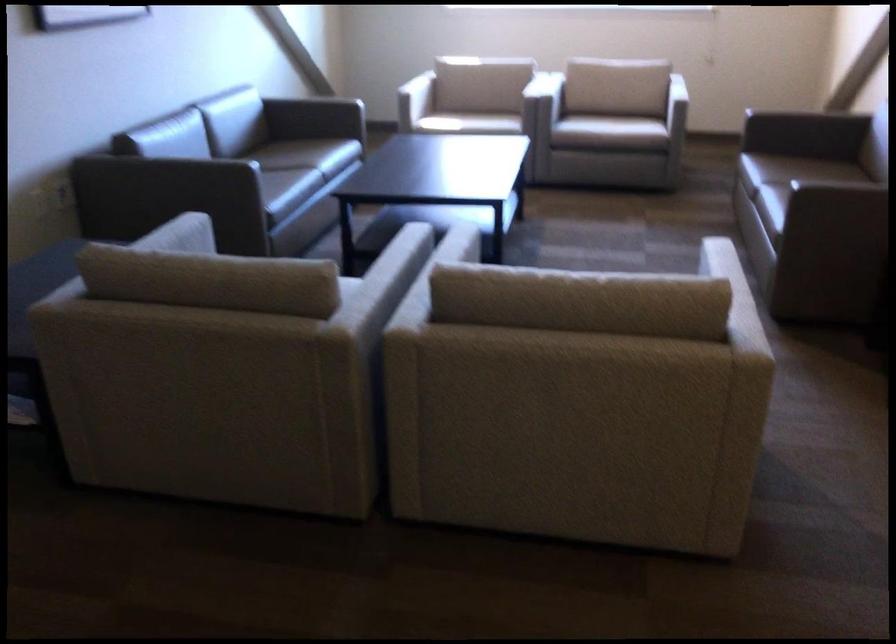
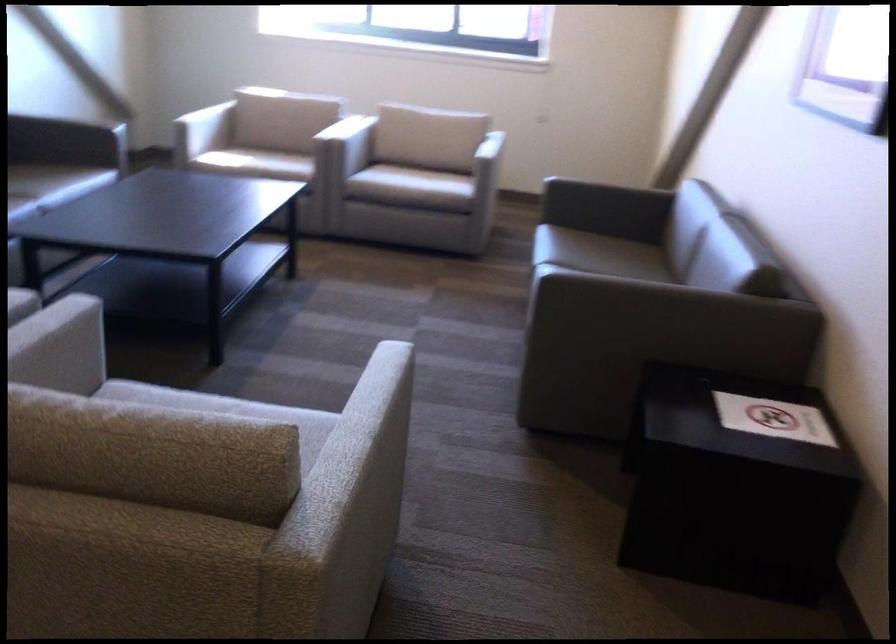
Question: The camera is either moving clockwise (left) or counter-clockwise (right) around the object. The first image is from the beginning of the video and the second image is from the end. Is the camera moving left or right when shooting the video?

Choices:
 (A) Left
 (B) Right

Answer: (A)